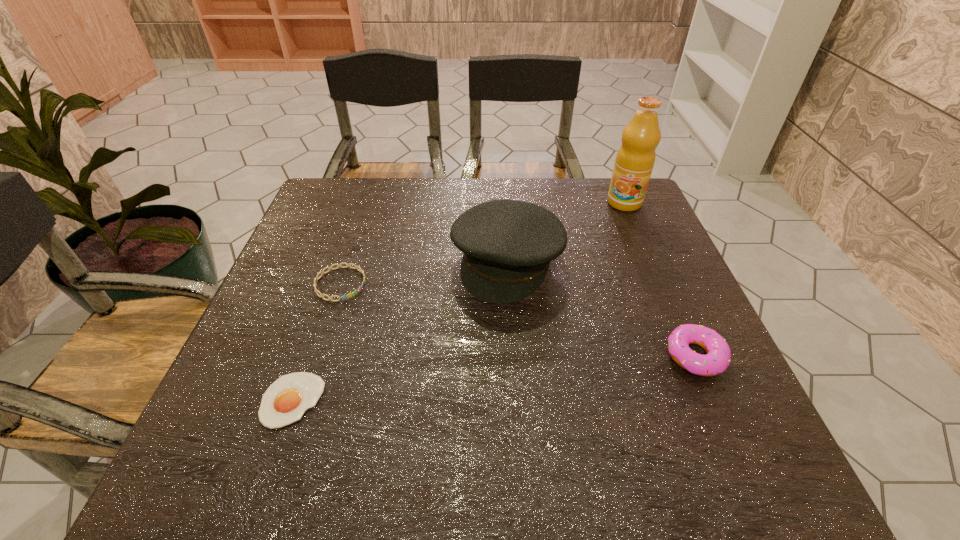
Identify which object is located as the nearest to the fruit juice. Please provide its 2D coordinates. Your answer should be formatted as a tuple, i.e. [(x, y)], where the tuple contains the x and y coordinates of a point satisfying the conditions above.

[(508, 245)]

Where is `object that is the fourth nearest to the tallest object`? The image size is (960, 540). object that is the fourth nearest to the tallest object is located at coordinates (285, 401).

You are a GUI agent. You are given a task and a screenshot of the screen. Output one action in this format:
    pyautogui.click(x=<x>, y=<y>)
    Task: Click on the free region that satisfies the following two spatial constraints: 1. on the back side of the tallest object; 2. on the right side of the egg yolk
    Image resolution: width=960 pixels, height=540 pixels.
    Given the screenshot: What is the action you would take?
    pyautogui.click(x=361, y=203)

In order to click on vacant area that satisfies the following two spatial constraints: 1. on the back side of the bracelet; 2. on the left side of the egg yolk in this screenshot , I will do `click(333, 284)`.

Locate an element on the screen. vacant region that satisfies the following two spatial constraints: 1. on the back side of the fourth tallest object; 2. on the right side of the shortest object is located at coordinates (333, 284).